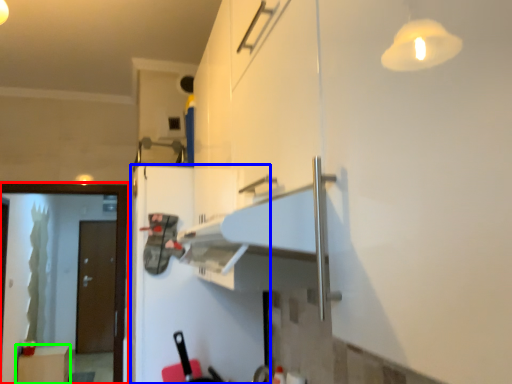
Question: Which is nearer to the screen door (highlighted by a red box)? fridge (highlighted by a blue box) or cabinetry (highlighted by a green box).

Choices:
 (A) fridge
 (B) cabinetry

Answer: (A)